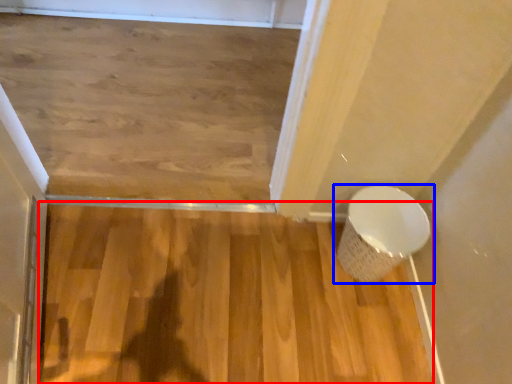
Question: Which object appears farthest to the camera in this image, hardwood (highlighted by a red box) or toilet (highlighted by a blue box)?

Choices:
 (A) hardwood
 (B) toilet

Answer: (B)